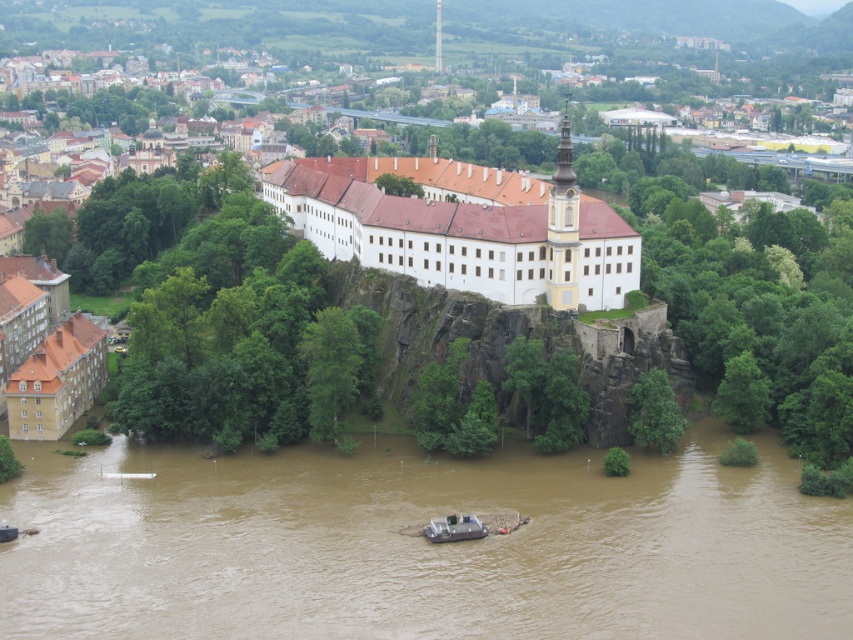
Question: Which point is farther to the camera?

Choices:
 (A) metallic gray boat at center
 (B) white smooth building at center
 (C) brown muddy water at lower center

Answer: (B)

Question: From the image, what is the correct spatial relationship of white smooth building at center in relation to metallic gray boat at center?

Choices:
 (A) above
 (B) below

Answer: (A)

Question: Is white smooth building at center to the right of metallic gray boat at center from the viewer's perspective?

Choices:
 (A) no
 (B) yes

Answer: (B)

Question: Which of the following is the farthest from the observer?

Choices:
 (A) (535, 545)
 (B) (485, 532)

Answer: (B)

Question: Which object appears farthest from the camera in this image?

Choices:
 (A) white smooth building at center
 (B) brown muddy water at lower center
 (C) metallic gray boat at center

Answer: (A)

Question: Does brown muddy water at lower center come in front of metallic gray boat at center?

Choices:
 (A) no
 (B) yes

Answer: (B)